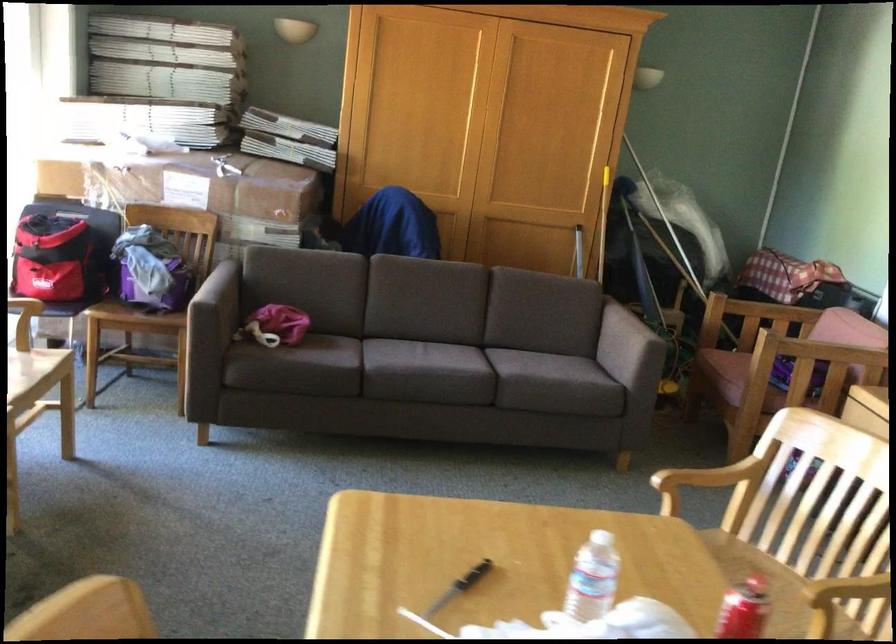
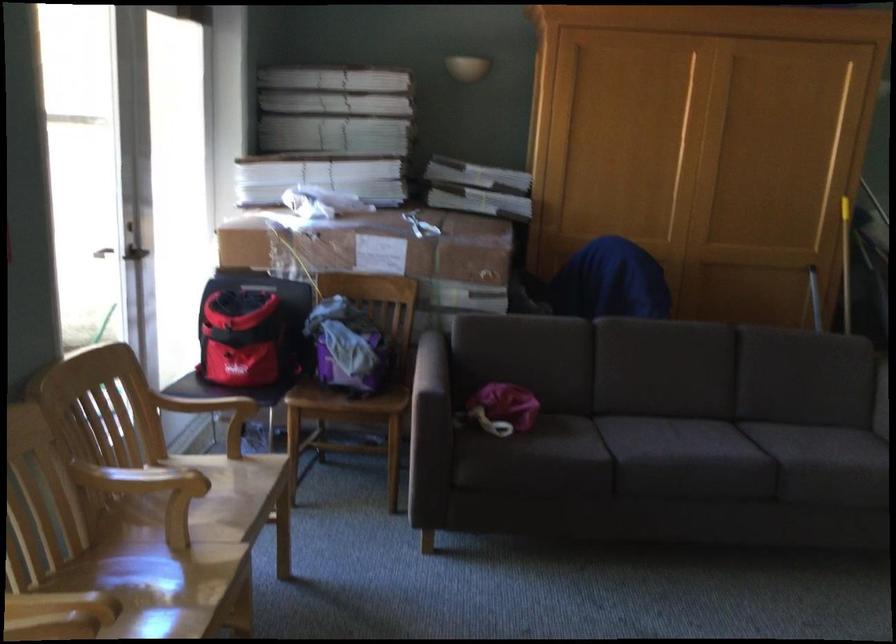
Where in the second image is the point corresponding to point (213, 288) from the first image?

(431, 365)